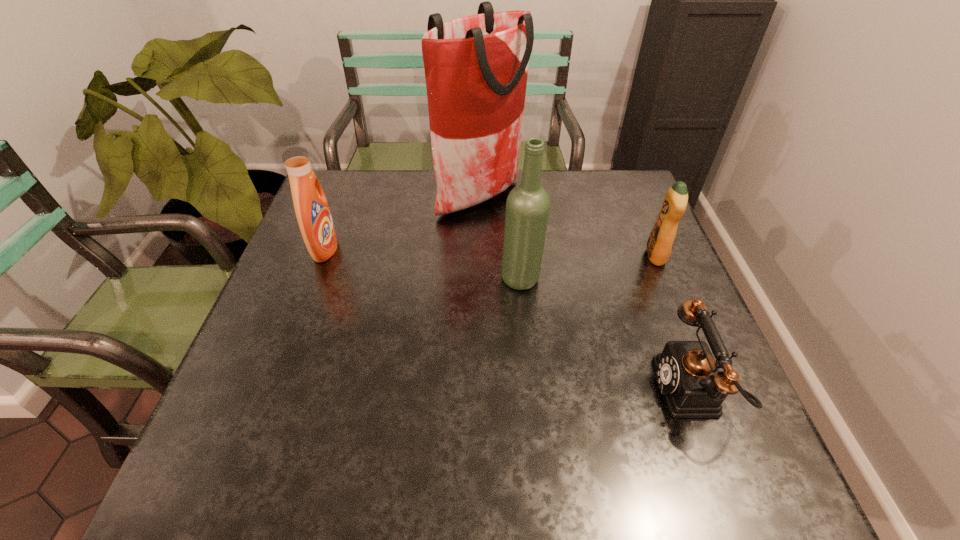
Image resolution: width=960 pixels, height=540 pixels. What are the coordinates of `detergent present at the right edge` in the screenshot? It's located at (659, 245).

At what (x,y) coordinates should I click in order to perform the action: click on telephone located in the right edge section of the desktop. Please return your answer as a coordinate pair (x, y). Looking at the image, I should click on (689, 377).

The image size is (960, 540). I want to click on free space at the far edge, so click(422, 176).

In the image, there is a desktop. At what (x,y) coordinates should I click in order to perform the action: click on free space at the left edge. Please return your answer as a coordinate pair (x, y). Looking at the image, I should click on (348, 270).

At what (x,y) coordinates should I click in order to perform the action: click on free space at the right edge of the desktop. Please return your answer as a coordinate pair (x, y). The height and width of the screenshot is (540, 960). Looking at the image, I should click on (627, 238).

Image resolution: width=960 pixels, height=540 pixels. What are the coordinates of `vacant space at the far left corner of the desktop` in the screenshot? It's located at (334, 182).

The width and height of the screenshot is (960, 540). In the image, there is a desktop. What are the coordinates of `blank space at the far right corner` in the screenshot? It's located at (617, 188).

The image size is (960, 540). In the image, there is a desktop. In order to click on vacant space at the near right corner in this screenshot , I will do `click(699, 483)`.

Locate an element on the screen. free spot between the taller detergent and the second shortest object is located at coordinates (491, 253).

At what (x,y) coordinates should I click in order to perform the action: click on free area in between the shorter detergent and the nearest object. Please return your answer as a coordinate pair (x, y). The image size is (960, 540). Looking at the image, I should click on (674, 323).